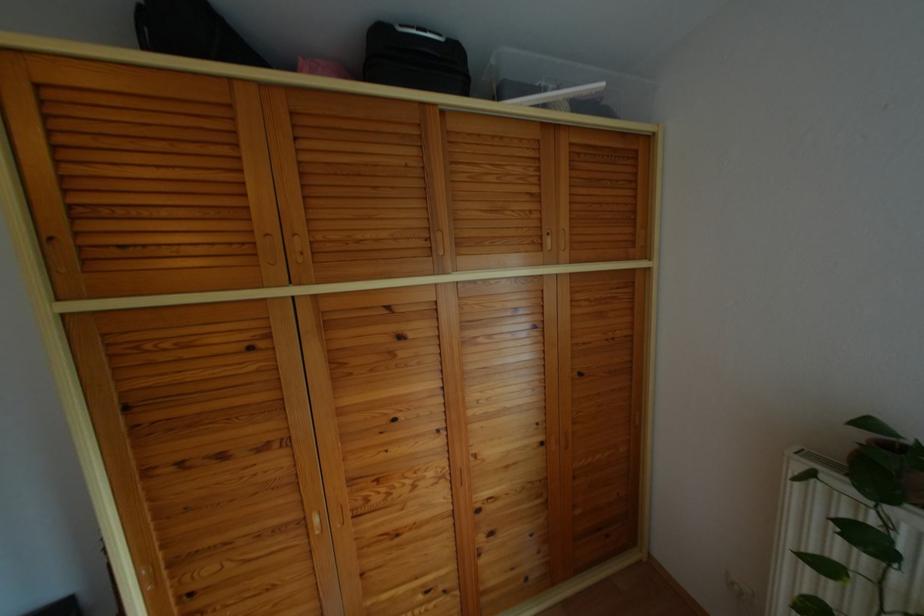
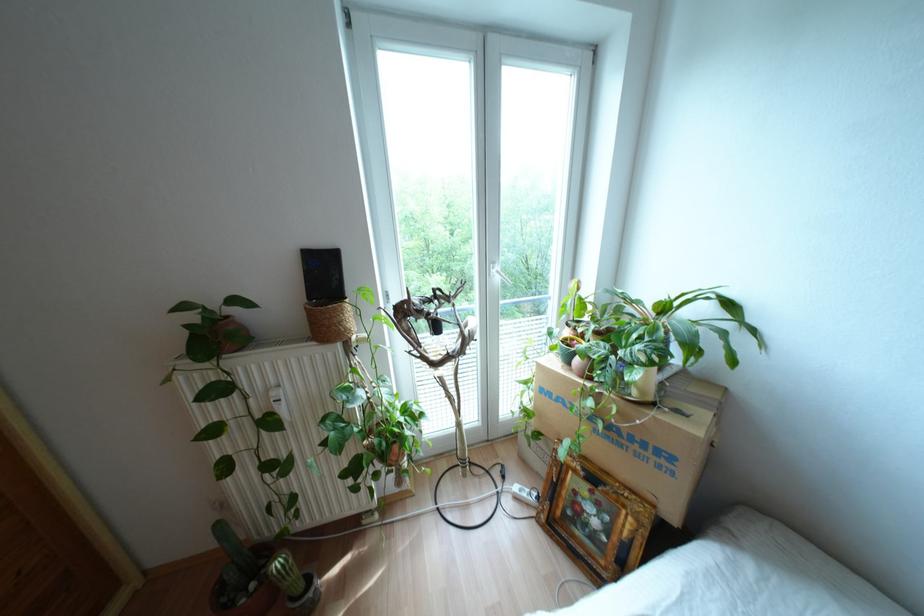
Question: The images are taken continuously from a first-person perspective. In which direction is your viewpoint rotating?

Choices:
 (A) Left
 (B) Right
 (C) Up
 (D) Down

Answer: (B)